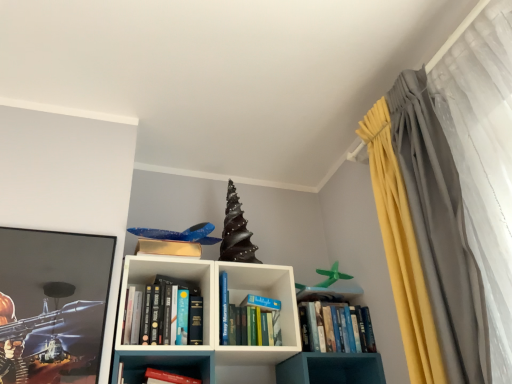
Question: From the image's perspective, is hardcover books at center, placed as the 1th book when sorted from left to right, located beneath blue hardcover book at center, acting as the first book starting from the right?

Choices:
 (A) no
 (B) yes

Answer: (A)

Question: Is hardcover books at center, placed as the 1th book when sorted from left to right, with blue hardcover book at center, acting as the first book starting from the right?

Choices:
 (A) yes
 (B) no

Answer: (B)

Question: Is hardcover books at center, placed as the 1th book when sorted from left to right, positioned far away from blue hardcover book at center, acting as the first book starting from the right?

Choices:
 (A) yes
 (B) no

Answer: (B)

Question: Is hardcover books at center, placed as the 1th book when sorted from left to right, taller than blue hardcover book at center, placed as the 3th book when sorted from left to right?

Choices:
 (A) yes
 (B) no

Answer: (A)

Question: Does hardcover books at center, which ranks as the third book in right-to-left order, turn towards blue hardcover book at center, placed as the 3th book when sorted from left to right?

Choices:
 (A) no
 (B) yes

Answer: (A)

Question: From the image's perspective, is silky gray curtain at right above or below blue hardcover book at center, placed as the 3th book when sorted from left to right?

Choices:
 (A) above
 (B) below

Answer: (A)

Question: Would you say silky gray curtain at right is inside or outside blue hardcover book at center, placed as the 3th book when sorted from left to right?

Choices:
 (A) outside
 (B) inside

Answer: (A)

Question: Is silky gray curtain at right taller or shorter than blue hardcover book at center, placed as the 3th book when sorted from left to right?

Choices:
 (A) tall
 (B) short

Answer: (A)

Question: Is silky gray curtain at right bigger or smaller than blue hardcover book at center, acting as the first book starting from the right?

Choices:
 (A) big
 (B) small

Answer: (A)

Question: From a real-world perspective, is blue hardcover book at center, acting as the first book starting from the right, positioned above or below metallic glossy picture frame at left?

Choices:
 (A) above
 (B) below

Answer: (B)

Question: Looking at their shapes, would you say blue hardcover book at center, placed as the 3th book when sorted from left to right, is wider or thinner than metallic glossy picture frame at left?

Choices:
 (A) thin
 (B) wide

Answer: (B)

Question: Considering their positions, is blue hardcover book at center, acting as the first book starting from the right, located in front of or behind metallic glossy picture frame at left?

Choices:
 (A) behind
 (B) front

Answer: (A)

Question: Is point (342, 329) closer or farther from the camera than point (39, 367)?

Choices:
 (A) closer
 (B) farther

Answer: (B)

Question: In terms of width, does hardcover book at center, which is counted as the second book, starting from the right, look wider or thinner when compared to hardcover book at center?

Choices:
 (A) wide
 (B) thin

Answer: (A)

Question: Choose the correct answer: Is hardcover book at center, which appears as the second book when viewed from the left, inside hardcover book at center or outside it?

Choices:
 (A) inside
 (B) outside

Answer: (B)